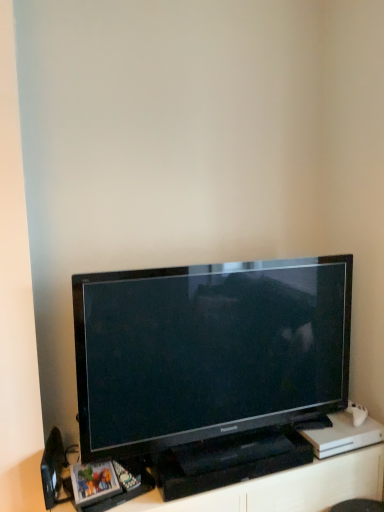
Question: Considering the positions of black plastic entertainment center at lower center and black glossy television at center in the image, is black plastic entertainment center at lower center wider or thinner than black glossy television at center?

Choices:
 (A) thin
 (B) wide

Answer: (B)

Question: From their relative heights in the image, would you say black plastic entertainment center at lower center is taller or shorter than black glossy television at center?

Choices:
 (A) tall
 (B) short

Answer: (B)

Question: Which object is the closest to the black plastic speaker at lower left?

Choices:
 (A) black glossy television at center
 (B) black plastic entertainment center at lower center

Answer: (B)

Question: Which object is positioned farthest from the black glossy television at center?

Choices:
 (A) black plastic entertainment center at lower center
 (B) black plastic speaker at lower left

Answer: (B)